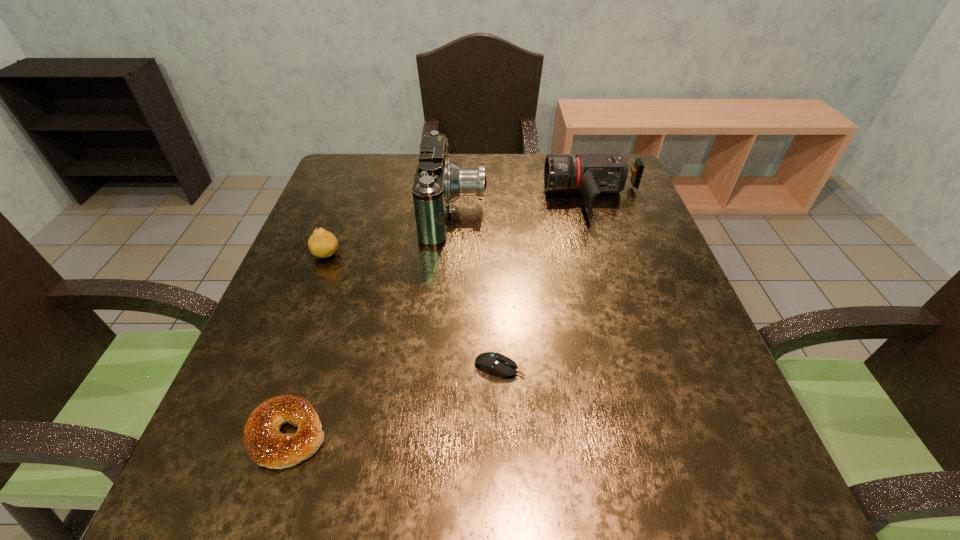
At what (x,y) coordinates should I click in order to perform the action: click on free space that is in between the pear and the bagel. Please return your answer as a coordinate pair (x, y). The height and width of the screenshot is (540, 960). Looking at the image, I should click on (307, 344).

Find the location of a particular element. The image size is (960, 540). free space between the nearest object and the right camcorder is located at coordinates (441, 316).

You are a GUI agent. You are given a task and a screenshot of the screen. Output one action in this format:
    pyautogui.click(x=<x>, y=<y>)
    Task: Click on the free space between the shortest object and the pear
    
    Given the screenshot: What is the action you would take?
    pyautogui.click(x=413, y=310)

Locate an element on the screen. free point between the right camcorder and the tallest object is located at coordinates (524, 205).

Locate an element on the screen. The image size is (960, 540). free space that is in between the nearest object and the pear is located at coordinates (307, 344).

Image resolution: width=960 pixels, height=540 pixels. What are the coordinates of `free space between the tallest object and the computer mouse` in the screenshot? It's located at pyautogui.click(x=477, y=290).

Where is `free point between the second shortest object and the rightmost object`? This screenshot has height=540, width=960. free point between the second shortest object and the rightmost object is located at coordinates (441, 316).

Where is `free space between the fourth farthest object and the taller camcorder`? This screenshot has width=960, height=540. free space between the fourth farthest object and the taller camcorder is located at coordinates (477, 290).

Image resolution: width=960 pixels, height=540 pixels. I want to click on the fourth closest object to the left camcorder, so click(265, 444).

The image size is (960, 540). I want to click on object that can be found as the closest to the left camcorder, so click(x=590, y=175).